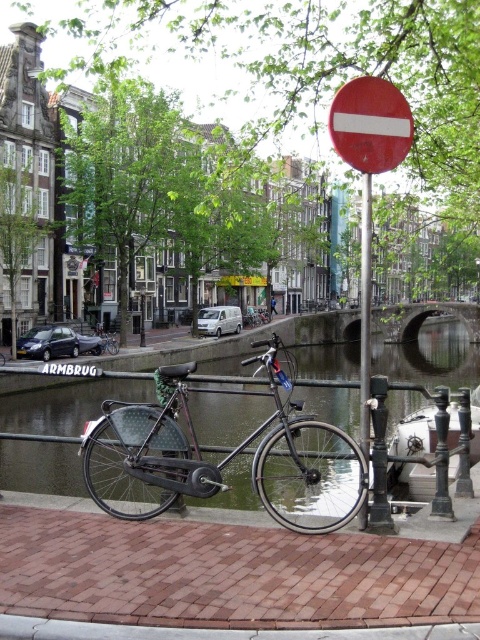
You are a tourist standing on the bridge and see both the matte red circle at center and the red matte circle at upper center. Which one is closer to you?

The matte red circle at center is closer to you because it is in front of the red matte circle at upper center.

You are standing on the brick pavement at lower center and want to reach the matte black bicycle at center. Which direction should you move to get closer to the bicycle?

Since the brick pavement at lower center is closer to the viewer than the matte black bicycle at center, you should move forward towards the bicycle to get closer to it.

You are standing at the edge of the canal and want to place a 30 feet long boat. Can the boat fit between the brick pavement at lower center and the viewer?

The distance between the brick pavement at lower center and the viewer is 25.03 feet, which is shorter than the boat length of 30 feet. Therefore, the boat cannot fit in that space.